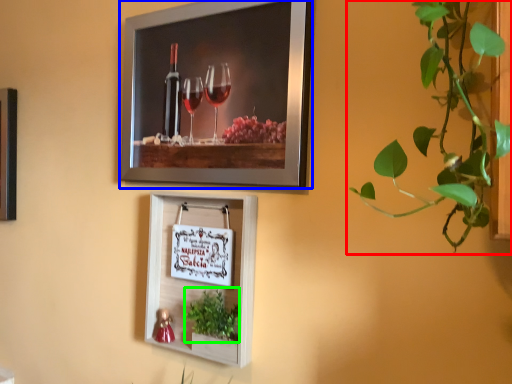
Question: Which object is the closest to the houseplant (highlighted by a red box)? Choose among these: picture frame (highlighted by a blue box) or plant (highlighted by a green box).

Choices:
 (A) picture frame
 (B) plant

Answer: (A)